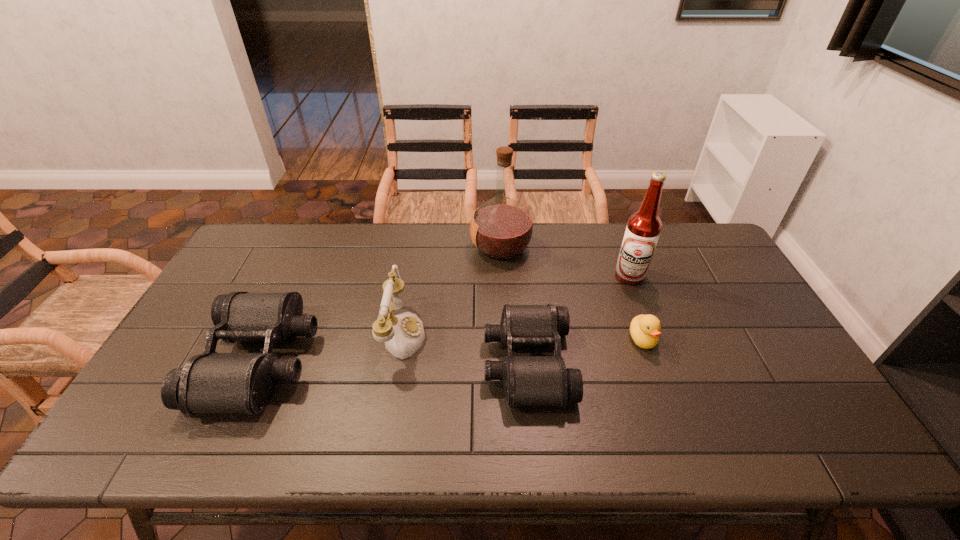
You are a GUI agent. You are given a task and a screenshot of the screen. Output one action in this format:
    pyautogui.click(x=<x>, y=<y>)
    Task: Click on the free point between the liquor and the alcohol
    This screenshot has width=960, height=540.
    Given the screenshot: What is the action you would take?
    pyautogui.click(x=565, y=262)

Locate an element on the screen. unoccupied area between the liquor and the alcohol is located at coordinates (565, 262).

You are a GUI agent. You are given a task and a screenshot of the screen. Output one action in this format:
    pyautogui.click(x=<x>, y=<y>)
    Task: Click on the unoccupied area between the fourth shortest object and the taller binoculars
    The width and height of the screenshot is (960, 540).
    Given the screenshot: What is the action you would take?
    pyautogui.click(x=330, y=347)

You are a GUI agent. You are given a task and a screenshot of the screen. Output one action in this format:
    pyautogui.click(x=<x>, y=<y>)
    Task: Click on the free spot between the second object from left to right and the right binoculars
    Image resolution: width=960 pixels, height=540 pixels.
    Given the screenshot: What is the action you would take?
    pyautogui.click(x=464, y=348)

The image size is (960, 540). Find the location of `vacant space that's between the duckling and the liquor`. vacant space that's between the duckling and the liquor is located at coordinates (571, 293).

Locate an element on the screen. free space between the liquor and the leftmost object is located at coordinates (380, 304).

Identify the location of object that is the second closest to the taller binoculars. Image resolution: width=960 pixels, height=540 pixels. (501, 228).

Select which object is the closest to the liquor. Please provide its 2D coordinates. Your answer should be formatted as a tuple, i.e. [(x, y)], where the tuple contains the x and y coordinates of a point satisfying the conditions above.

[(403, 334)]

In order to click on free space that satisfies the following two spatial constraints: 1. on the label side of the alcohol; 2. through the eyepieces of the right binoculars in this screenshot , I will do `click(662, 362)`.

This screenshot has width=960, height=540. I want to click on vacant region that satisfies the following two spatial constraints: 1. on the label side of the alcohol; 2. through the eyepieces of the shorter binoculars, so click(662, 362).